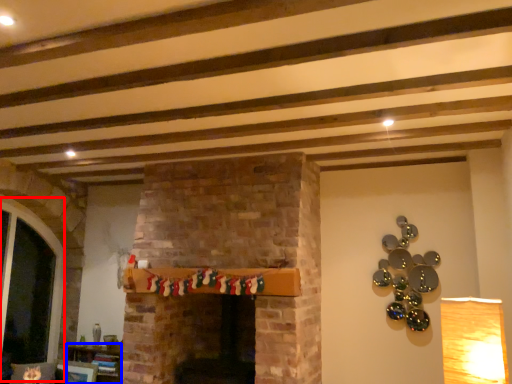
Question: Among these objects, which one is farthest to the camera, glass door (highlighted by a red box) or furniture (highlighted by a blue box)?

Choices:
 (A) glass door
 (B) furniture

Answer: (B)